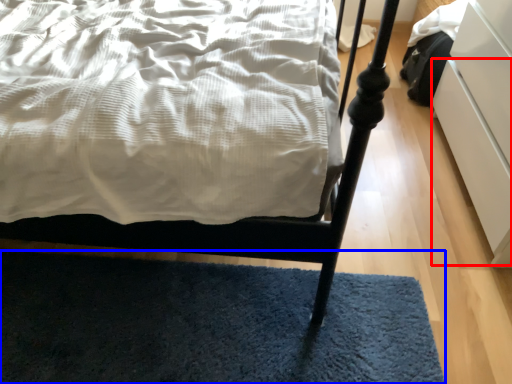
Question: Among these objects, which one is farthest to the camera, drawer (highlighted by a red box) or mat (highlighted by a blue box)?

Choices:
 (A) drawer
 (B) mat

Answer: (B)